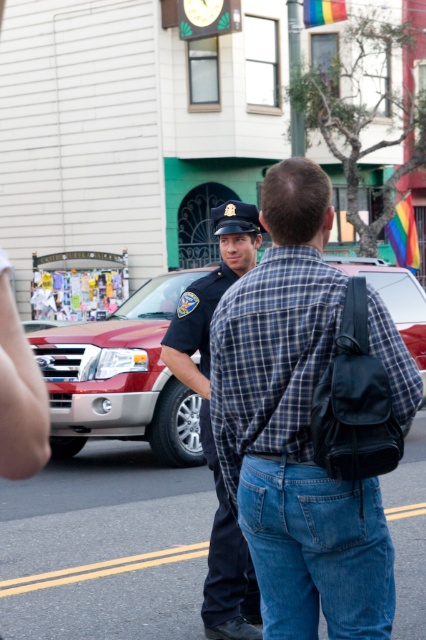
Based on the scene description, where is the blue plaid shirt at center located in the image?

The blue plaid shirt at center is located at point (294, 428) in the image.

You are standing at the point labeled point (150,289) and want to walk towards the point labeled point (313,296). Will you be moving closer to the camera or farther away from it?

Since point (313,296) is closer to the camera than point (150,289), moving towards it would mean you are getting closer to the camera.